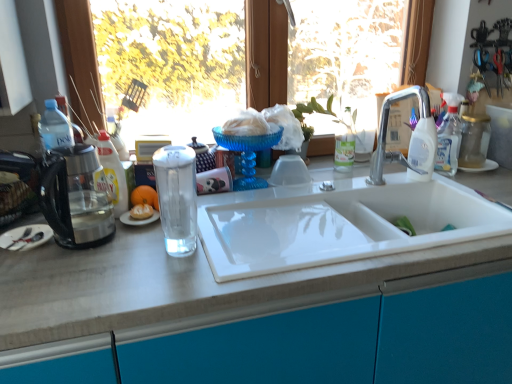
I want to click on free space in front of orange matte at center, so click(123, 247).